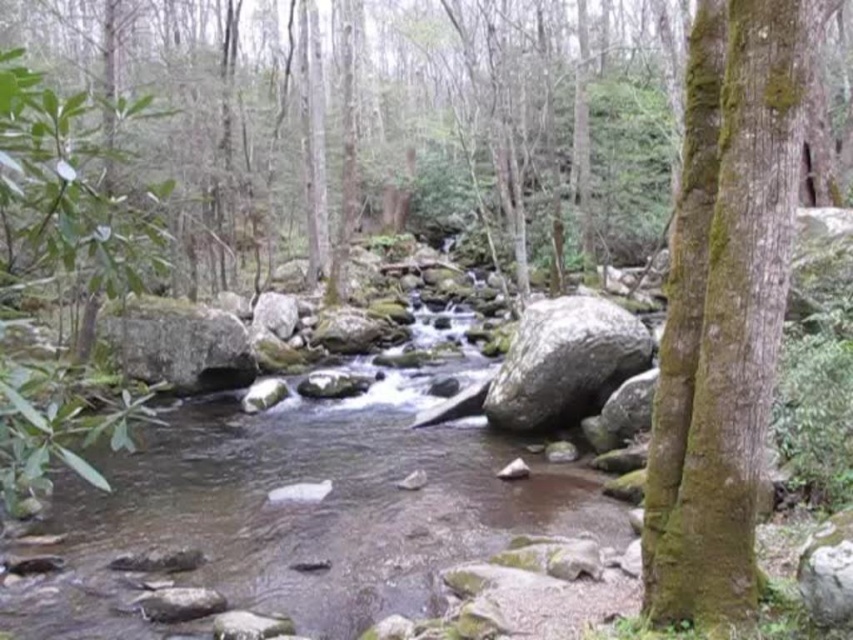
Question: Which of the following is the closest to the observer?

Choices:
 (A) (738, 205)
 (B) (436, 461)

Answer: (A)

Question: Considering the relative positions of clear water at center and green mossy bark tree at right in the image provided, where is clear water at center located with respect to green mossy bark tree at right?

Choices:
 (A) right
 (B) left

Answer: (B)

Question: Is clear water at center below green mossy bark tree at right?

Choices:
 (A) yes
 (B) no

Answer: (A)

Question: Which object is farther from the camera taking this photo?

Choices:
 (A) green mossy bark tree at right
 (B) clear water at center

Answer: (B)

Question: Is clear water at center further to the viewer compared to green mossy bark tree at right?

Choices:
 (A) no
 (B) yes

Answer: (B)

Question: Which object appears closest to the camera in this image?

Choices:
 (A) green mossy bark tree at right
 (B) clear water at center

Answer: (A)